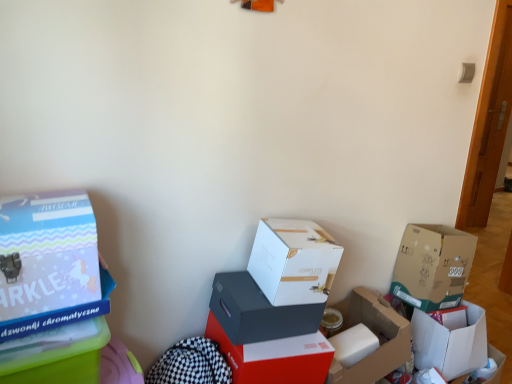
Question: Is matte black box at center, which is the 5th box in right-to-left order, facing towards white matte box at center, the fourth box from the right?

Choices:
 (A) no
 (B) yes

Answer: (A)

Question: Can you confirm if matte black box at center, placed as the fourth box when sorted from left to right, is positioned to the left of white matte box at center, arranged as the 5th box when viewed from the left?

Choices:
 (A) yes
 (B) no

Answer: (A)

Question: Is matte black box at center, which is the 5th box in right-to-left order, shorter than white matte box at center, the fourth box from the right?

Choices:
 (A) no
 (B) yes

Answer: (B)

Question: From the image's perspective, is matte black box at center, placed as the fourth box when sorted from left to right, beneath white matte box at center, arranged as the 5th box when viewed from the left?

Choices:
 (A) yes
 (B) no

Answer: (A)

Question: Relative to matte blue box at left, which appears as the 1th box when viewed from the left, is matte red box at center, which ranks as the third box in left-to-right order, in front or behind?

Choices:
 (A) behind
 (B) front

Answer: (A)

Question: Considering the relative positions of matte red box at center, which appears as the sixth box when viewed from the right, and matte blue box at left, placed as the eighth box when sorted from right to left, in the image provided, is matte red box at center, which appears as the sixth box when viewed from the right, to the left or to the right of matte blue box at left, placed as the eighth box when sorted from right to left,?

Choices:
 (A) left
 (B) right

Answer: (B)

Question: In terms of size, does matte red box at center, which ranks as the third box in left-to-right order, appear bigger or smaller than matte blue box at left, which appears as the 1th box when viewed from the left?

Choices:
 (A) big
 (B) small

Answer: (A)

Question: Is point (224, 331) positioned closer to the camera than point (16, 324)?

Choices:
 (A) closer
 (B) farther

Answer: (B)

Question: Considering the positions of matte red box at center, which appears as the sixth box when viewed from the right, and cardboard box at lower right, the 3th box viewed from the right, in the image, is matte red box at center, which appears as the sixth box when viewed from the right, taller or shorter than cardboard box at lower right, the 3th box viewed from the right,?

Choices:
 (A) tall
 (B) short

Answer: (A)

Question: Based on their sizes in the image, would you say matte red box at center, which ranks as the third box in left-to-right order, is bigger or smaller than cardboard box at lower right, the 6th box in the left-to-right sequence?

Choices:
 (A) big
 (B) small

Answer: (A)

Question: From the image's perspective, is matte red box at center, which ranks as the third box in left-to-right order, located above or below cardboard box at lower right, the 6th box in the left-to-right sequence?

Choices:
 (A) below
 (B) above

Answer: (A)

Question: Relative to cardboard box at lower right, the 3th box viewed from the right, is matte red box at center, which ranks as the third box in left-to-right order, in front or behind?

Choices:
 (A) behind
 (B) front

Answer: (B)

Question: From the image's perspective, is white cardboard box at lower right, the 1th box in the right-to-left sequence, located above or below matte black box at center, which is the 5th box in right-to-left order?

Choices:
 (A) above
 (B) below

Answer: (B)

Question: From a real-world perspective, is white cardboard box at lower right, the 1th box in the right-to-left sequence, positioned above or below matte black box at center, placed as the fourth box when sorted from left to right?

Choices:
 (A) above
 (B) below

Answer: (B)